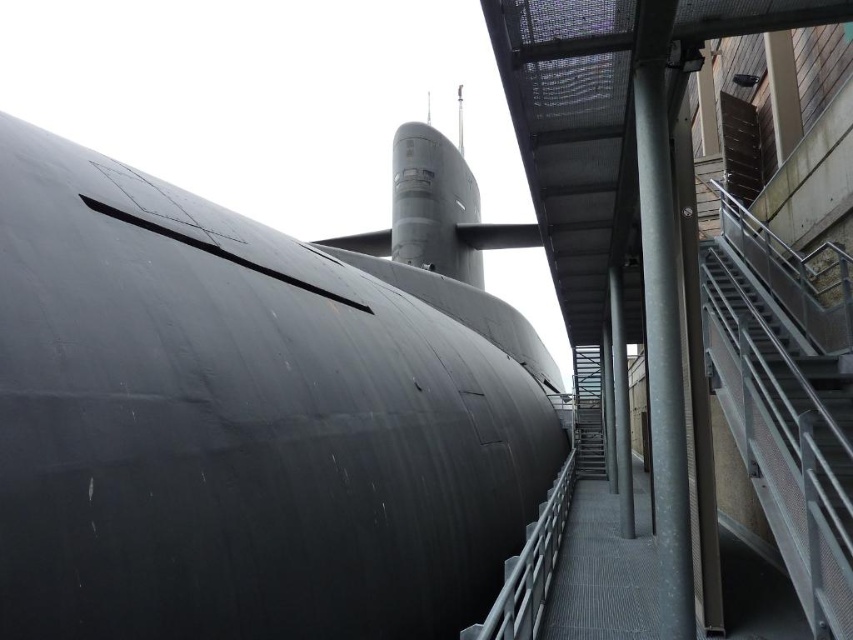
From the picture: Which is above, matte black submarine at center or metallic gray staircase at right?

Positioned higher is matte black submarine at center.

Consider the image. Can you confirm if matte black submarine at center is bigger than metallic gray staircase at right?

Indeed, matte black submarine at center has a larger size compared to metallic gray staircase at right.

Is point (343, 624) more distant than point (799, 429)?

Yes, point (343, 624) is farther from viewer.

You are a GUI agent. You are given a task and a screenshot of the screen. Output one action in this format:
    pyautogui.click(x=<x>, y=<y>)
    Task: Click on the matte black submarine at center
    The image size is (853, 640).
    Given the screenshot: What is the action you would take?
    pyautogui.click(x=245, y=420)